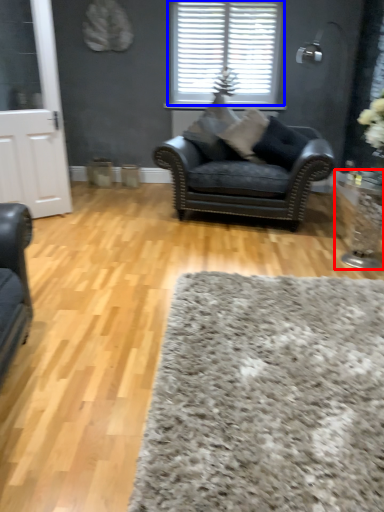
Question: Among these objects, which one is farthest to the camera, side table (highlighted by a red box) or window (highlighted by a blue box)?

Choices:
 (A) side table
 (B) window

Answer: (B)